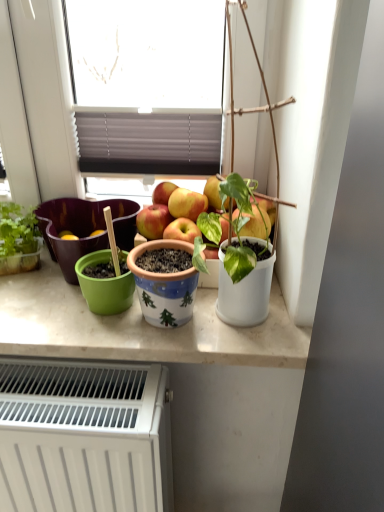
Question: Considering the relative positions of blue ceramic pot at center, which is the second flowerpot in left-to-right order, and white matte pot at right in the image provided, is blue ceramic pot at center, which is the second flowerpot in left-to-right order, to the left or to the right of white matte pot at right?

Choices:
 (A) right
 (B) left

Answer: (B)

Question: From a real-world perspective, is blue ceramic pot at center, arranged as the 1th flowerpot when viewed from the front, physically located above or below white matte pot at right?

Choices:
 (A) above
 (B) below

Answer: (B)

Question: Which object is positioned farthest from the white glossy countertop at center?

Choices:
 (A) green matte flowerpot at left, acting as the 2th flowerpot starting from the right
 (B) white matte pot at right
 (C) white matte radiator at lower left
 (D) blue ceramic pot at center, the 2th flowerpot when ordered from back to front

Answer: (B)

Question: Which object is the farthest from the green matte flowerpot at left, which appears as the first flowerpot when viewed from the back?

Choices:
 (A) white glossy countertop at center
 (B) white matte radiator at lower left
 (C) white matte pot at right
 (D) blue ceramic pot at center, which ranks as the first flowerpot in right-to-left order

Answer: (C)